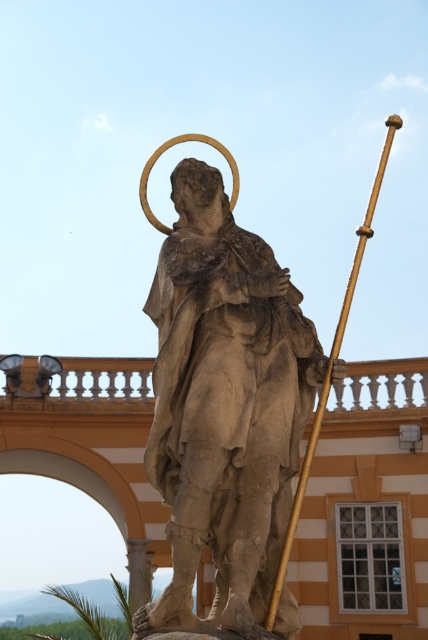
Between stone statue at center and gold polished staff at center-right, which one is positioned higher?

gold polished staff at center-right is higher up.

Is point (258, 604) farther from camera compared to point (282, 570)?

Yes, point (258, 604) is farther from viewer.

What are the coordinates of `stone statue at center` in the screenshot? It's located at (225, 404).